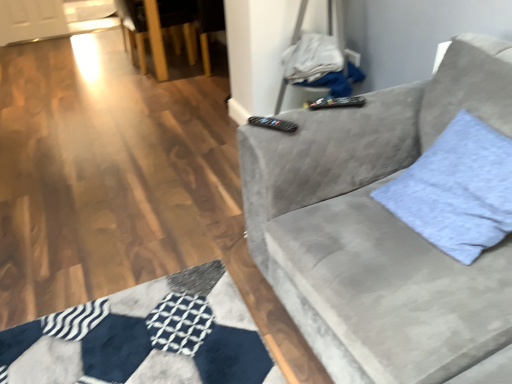
Question: From the image's perspective, is light blue fabric pillow at right above or below velvet gray couch at right?

Choices:
 (A) below
 (B) above

Answer: (B)

Question: Is point (462, 114) closer or farther from the camera than point (318, 127)?

Choices:
 (A) closer
 (B) farther

Answer: (A)

Question: Estimate the real-world distances between objects in this image. Which object is closer to the velvet gray couch at right?

Choices:
 (A) black plastic remote at upper center, the second remote when ordered from left to right
 (B) light blue fabric pillow at right
 (C) black plastic remote at upper center, the 1th remote viewed from the front
 (D) wooden armchair at upper left

Answer: (B)

Question: Which object is the closest to the velvet gray couch at right?

Choices:
 (A) black plastic remote at upper center, which ranks as the second remote in front-to-back order
 (B) wooden armchair at upper left
 (C) light blue fabric pillow at right
 (D) black plastic remote at upper center, which appears as the 1th remote when ordered from the bottom

Answer: (C)